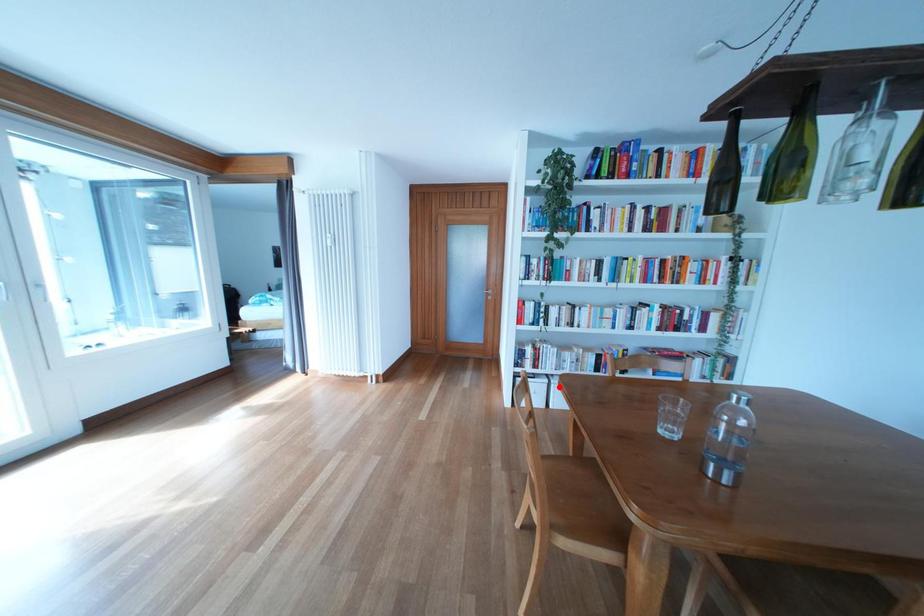
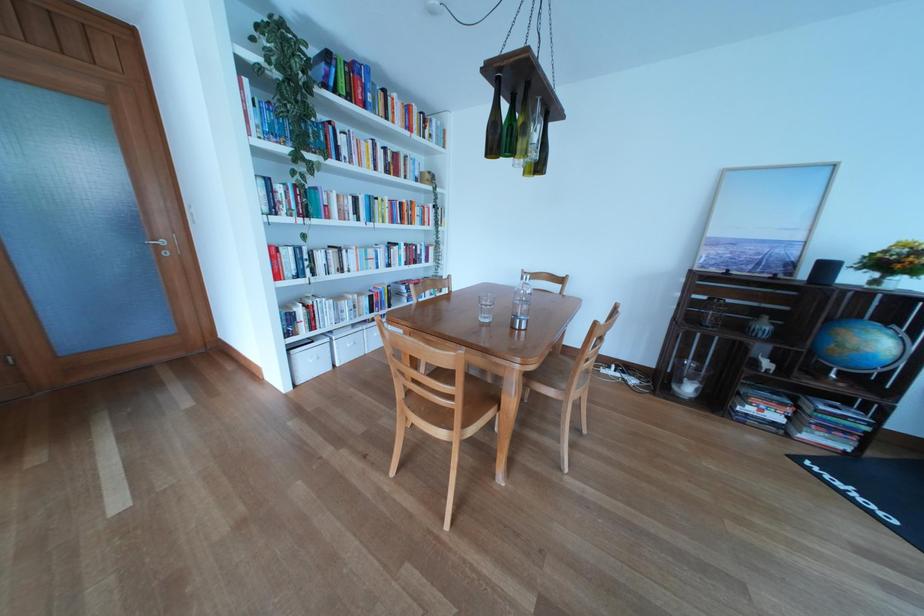
Where in the second image is the point corresponding to the highlighted location from the first image?

(341, 345)